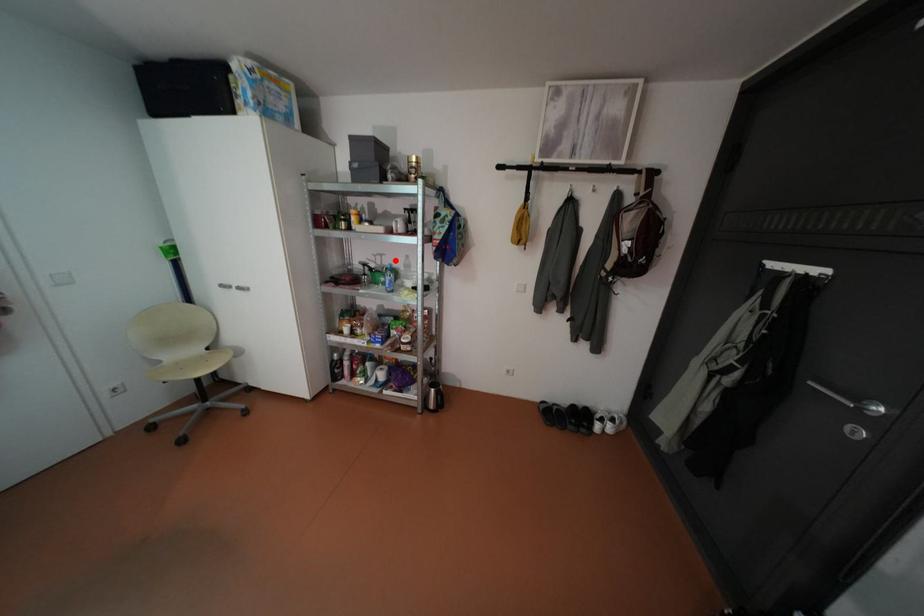
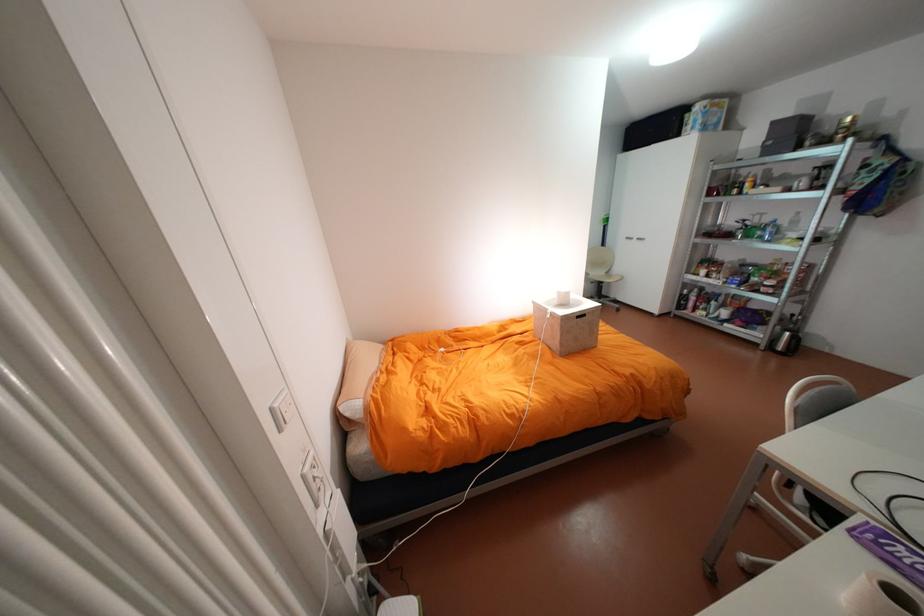
Question: I am providing you with two images of the same scene from different viewpoints. A red point is marked on the first image. Can you still see the location of the red point in image 2?

Choices:
 (A) Yes
 (B) No

Answer: (A)